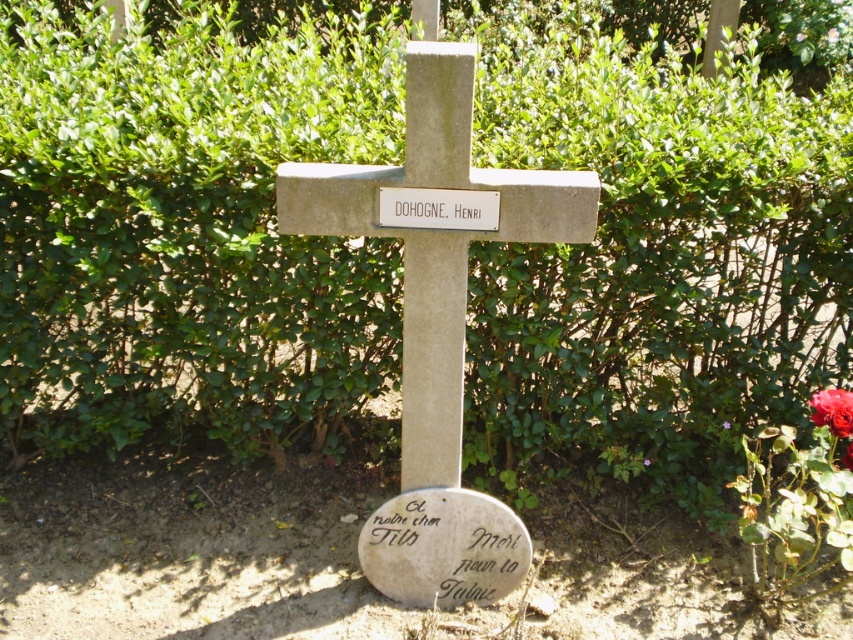
You are a florist who needs to place a new red rose bouquet between the red rose at center right and the red matte rose at center right. Which rose should you place the bouquet closer to to ensure it doesn not block the memorial cross? Please explain your reasoning.

The red rose at center right is larger than the red matte rose at center right. To avoid blocking the memorial cross, the bouquet should be placed closer to the smaller red matte rose at center right since it has a smaller size and would require less space.